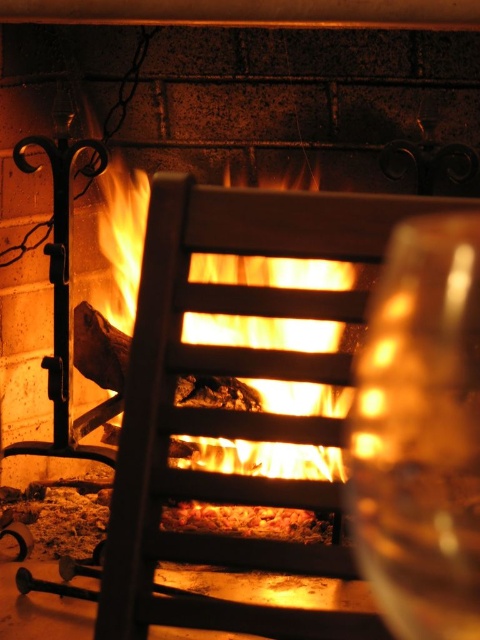
From the picture: You are sitting on a couch facing the fireplace and want to place a small decorative item on the transparent glass at right and the orange glowing wood at center. Which surface will allow the item to be seen from a greater distance?

The transparent glass at right has a lesser height compared to orange glowing wood at center, so placing the item on the orange glowing wood at center will make it visible from a greater distance because it is taller.

You are holding a 12 inch long wooden stick. You want to use it to reach the transparent glass at right from your current position. Can you reach it without moving closer?

The transparent glass at right is 27.01 inches away from the viewer. Since the wooden stick is only 12 inches long, it is not long enough to reach the glass. You would need a longer tool to reach it.

You are a guest in this living room and want to place a small candle on the transparent glass at right. However, you need to ensure it won not block the view of the orange glowing wood at center. Can you do this?

The transparent glass at right is smaller than orange glowing wood at center, so placing a small candle on the transparent glass at right would not block the view of the orange glowing wood at center since the glass itself is smaller and the candle would occupy only part of it.